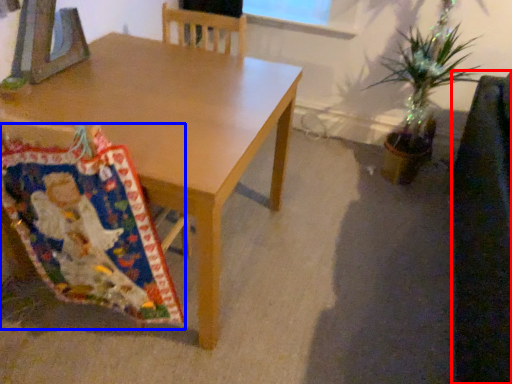
Question: Among these objects, which one is farthest to the camera, swivel chair (highlighted by a red box) or blanket (highlighted by a blue box)?

Choices:
 (A) swivel chair
 (B) blanket

Answer: (B)